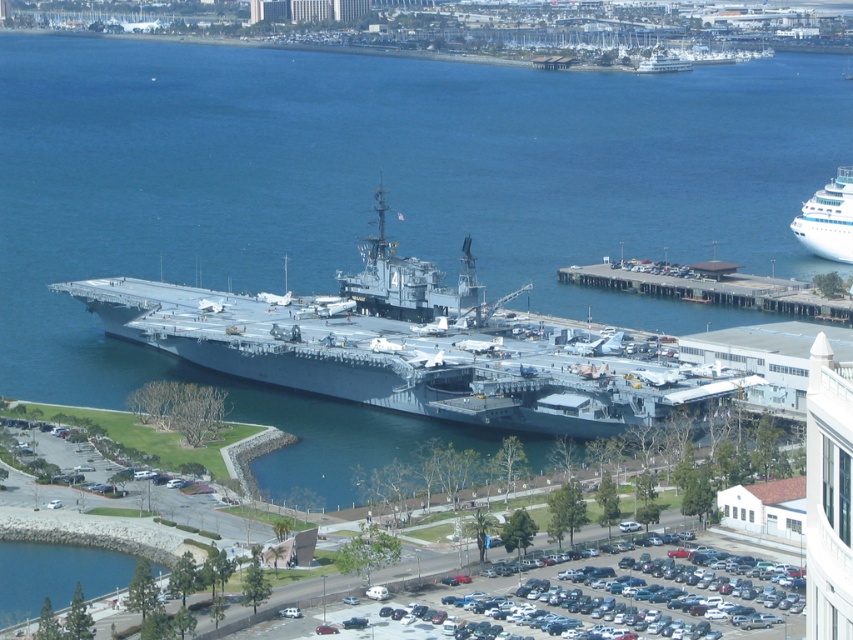
Is gray metallic aircraft carrier at center above white glossy boat at upper right?

No.

Who is higher up, gray metallic aircraft carrier at center or white glossy boat at upper right?

Positioned higher is white glossy boat at upper right.

Locate an element on the screen. The image size is (853, 640). gray metallic aircraft carrier at center is located at coordinates (410, 348).

Is point (654, 381) closer to camera compared to point (801, 214)?

Yes, point (654, 381) is closer to viewer.

The image size is (853, 640). What do you see at coordinates (410, 348) in the screenshot? I see `gray metallic aircraft carrier at center` at bounding box center [410, 348].

Which is behind, point (236, 316) or point (837, 224)?

The point (837, 224) is more distant.

I want to click on gray metallic aircraft carrier at center, so click(x=410, y=348).

The width and height of the screenshot is (853, 640). Find the location of `concrete dock at center right`. concrete dock at center right is located at coordinates (712, 289).

Between concrete dock at center right and white glossy cruise ship at upper right, which one appears on the right side from the viewer's perspective?

From the viewer's perspective, white glossy cruise ship at upper right appears more on the right side.

Identify the location of concrete dock at center right. (712, 289).